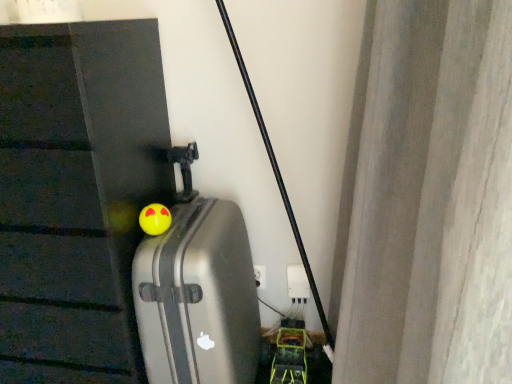
Question: From a real-world perspective, is silver metallic suitcase at center above or below yellow rubber ball at center?

Choices:
 (A) above
 (B) below

Answer: (B)

Question: Looking at their shapes, would you say silver metallic suitcase at center is wider or thinner than yellow rubber ball at center?

Choices:
 (A) thin
 (B) wide

Answer: (B)

Question: In terms of height, does silver metallic suitcase at center look taller or shorter compared to yellow rubber ball at center?

Choices:
 (A) short
 (B) tall

Answer: (B)

Question: Is yellow rubber ball at center bigger or smaller than silver metallic suitcase at center?

Choices:
 (A) small
 (B) big

Answer: (A)

Question: Is yellow rubber ball at center taller or shorter than silver metallic suitcase at center?

Choices:
 (A) short
 (B) tall

Answer: (A)

Question: Would you say yellow rubber ball at center is to the left or to the right of silver metallic suitcase at center in the picture?

Choices:
 (A) right
 (B) left

Answer: (B)

Question: From the image's perspective, is yellow rubber ball at center above or below silver metallic suitcase at center?

Choices:
 (A) below
 (B) above

Answer: (B)